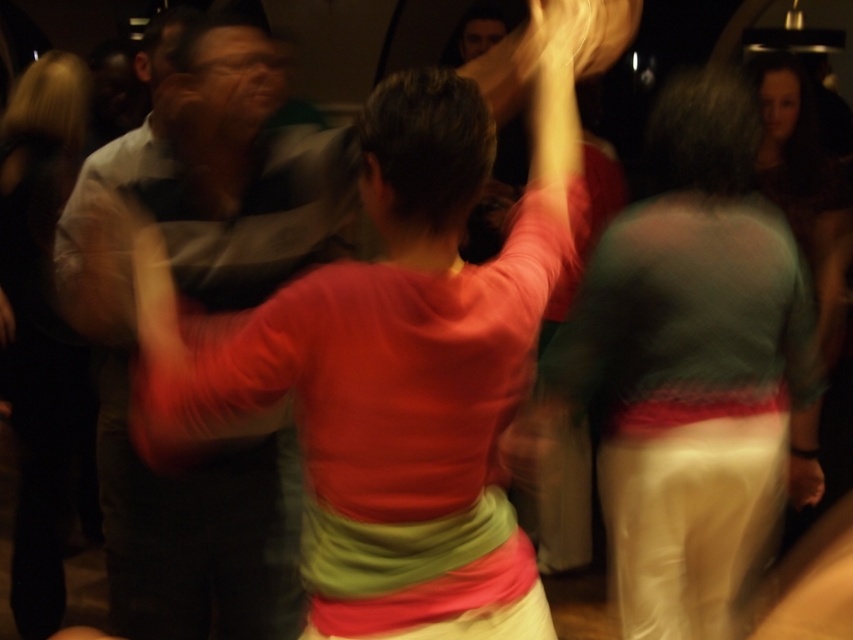
Question: Estimate the real-world distances between objects in this image. Which object is closer to the striped cotton shirt at center?

Choices:
 (A) matte green sweater at center
 (B) matte red sweater at center

Answer: (A)

Question: Based on their relative distances, which object is farther from the matte green sweater at center?

Choices:
 (A) matte red sweater at center
 (B) striped cotton shirt at center

Answer: (A)

Question: Is matte green sweater at center below striped cotton shirt at center?

Choices:
 (A) no
 (B) yes

Answer: (B)

Question: Is the position of matte green sweater at center more distant than that of matte red sweater at center?

Choices:
 (A) no
 (B) yes

Answer: (A)

Question: Based on their relative distances, which object is nearer to the matte green sweater at center?

Choices:
 (A) matte red sweater at center
 (B) striped cotton shirt at center

Answer: (B)

Question: Does striped cotton shirt at center appear over matte red sweater at center?

Choices:
 (A) no
 (B) yes

Answer: (A)